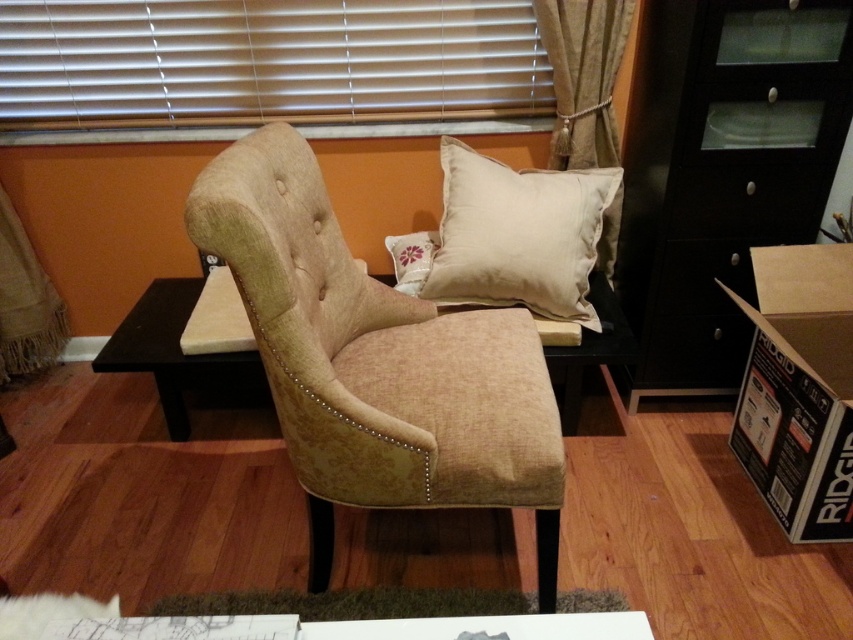
Question: Does white blinds at upper center have a greater width compared to matte black drawer at right?

Choices:
 (A) yes
 (B) no

Answer: (A)

Question: Which of the following is the closest to the observer?

Choices:
 (A) white blinds at upper center
 (B) matte black drawer at right
 (C) beige fabric pillow at upper center
 (D) beige fabric table at center

Answer: (B)

Question: Does white blinds at upper center appear under beige fabric curtain at upper right?

Choices:
 (A) no
 (B) yes

Answer: (A)

Question: Which of the following is the closest to the observer?

Choices:
 (A) beige fabric curtain at upper right
 (B) white blinds at upper center
 (C) beige fabric table at center

Answer: (A)

Question: Is white blinds at upper center below burlap curtain at lower left?

Choices:
 (A) yes
 (B) no

Answer: (B)

Question: Which point is farther to the camera?

Choices:
 (A) burlap curtain at lower left
 (B) beige fabric swivel chair at center
 (C) matte black drawer at right
 (D) white blinds at upper center

Answer: (A)